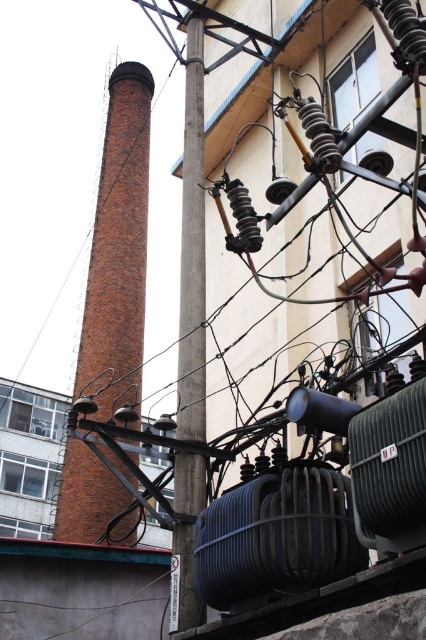
Question: Among these objects, which one is farthest from the camera?

Choices:
 (A) red brick chimney at left
 (B) smooth gray pole at center

Answer: (A)

Question: Which point is closer to the camera?

Choices:
 (A) (109, 244)
 (B) (172, 625)

Answer: (B)

Question: Can you confirm if red brick chimney at left is smaller than smooth gray pole at center?

Choices:
 (A) yes
 (B) no

Answer: (B)

Question: Can you confirm if red brick chimney at left is positioned to the left of smooth gray pole at center?

Choices:
 (A) yes
 (B) no

Answer: (A)

Question: Is red brick chimney at left wider than smooth gray pole at center?

Choices:
 (A) no
 (B) yes

Answer: (B)